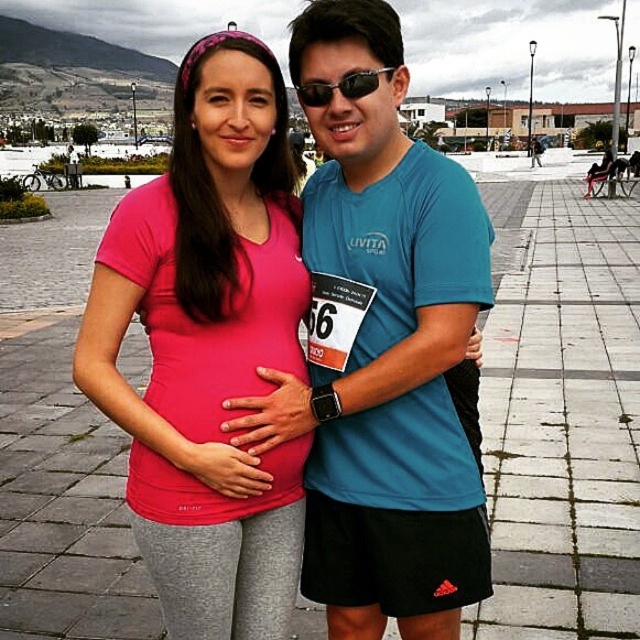
Question: Based on their relative distances, which object is farther from the blue t-shirt at center?

Choices:
 (A) sunglasses at center
 (B) matte pink shirt at center

Answer: (A)

Question: Considering the relative positions of matte pink shirt at center and blue t-shirt at center in the image provided, where is matte pink shirt at center located with respect to blue t-shirt at center?

Choices:
 (A) right
 (B) left

Answer: (B)

Question: Considering the relative positions of gray concrete pavement at center and matte pink shirt at center in the image provided, where is gray concrete pavement at center located with respect to matte pink shirt at center?

Choices:
 (A) above
 (B) below

Answer: (A)

Question: Observing the image, what is the correct spatial positioning of matte pink shirt at center in reference to blue t-shirt at center?

Choices:
 (A) left
 (B) right

Answer: (A)

Question: Which point is closer to the camera?

Choices:
 (A) (365, 90)
 (B) (509, 244)

Answer: (A)

Question: Which of the following is the closest to the observer?

Choices:
 (A) blue t-shirt at center
 (B) sunglasses at center
 (C) matte pink shirt at center
 (D) gray concrete pavement at center

Answer: (C)